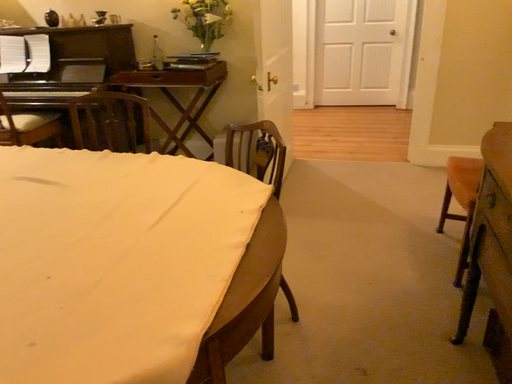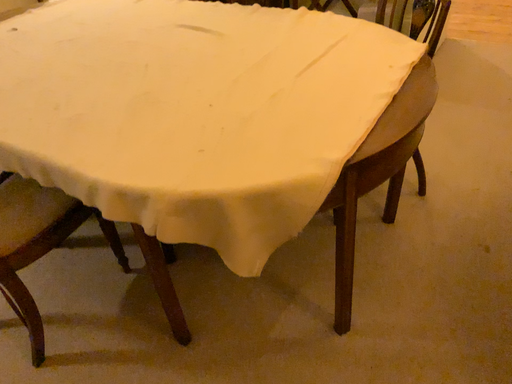
Question: Which way did the camera rotate in the video?

Choices:
 (A) rotated left
 (B) rotated right

Answer: (A)